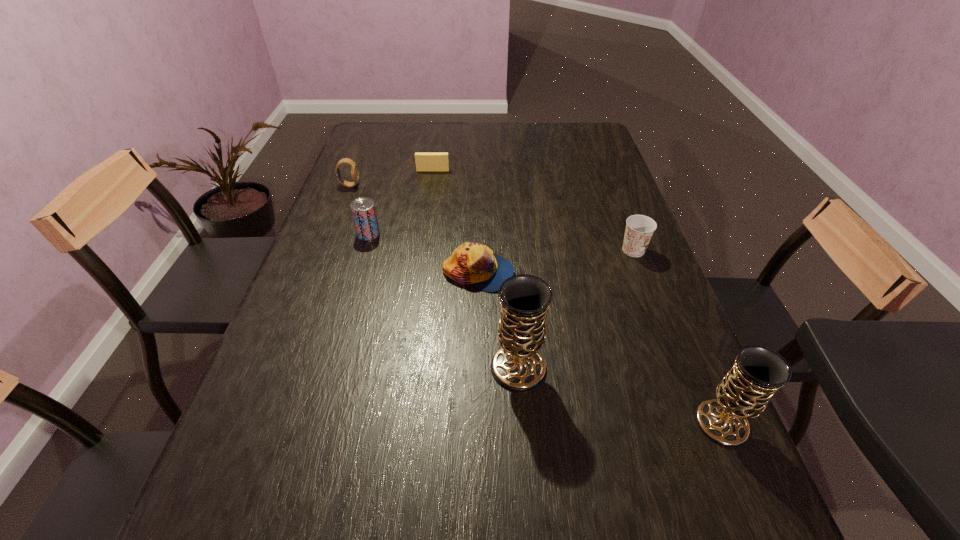
Locate an element on the screen. Image resolution: width=960 pixels, height=540 pixels. the second shortest object is located at coordinates (475, 264).

Identify the location of Dixie cup. The image size is (960, 540). (639, 229).

Find the location of a particular element. vacant region located 0.170m on the left of the taller chalice is located at coordinates (409, 367).

Identify the location of vacant position located 0.270m on the left of the nearer chalice. The image size is (960, 540). (553, 422).

Identify the location of vacant space located 0.050m at the front of the shortest object with spools. (431, 180).

Find the location of a particular element. The image size is (960, 540). free region located 0.300m on the face of the leftmost object is located at coordinates (452, 185).

Where is `blank space located 0.270m on the back of the fifth nearest object`? blank space located 0.270m on the back of the fifth nearest object is located at coordinates (385, 177).

This screenshot has height=540, width=960. I want to click on free space located on the bill of the sixth tallest object, so click(x=577, y=273).

The width and height of the screenshot is (960, 540). Find the location of `free space located 0.390m on the left of the Dixie cup`. free space located 0.390m on the left of the Dixie cup is located at coordinates (474, 251).

In order to click on object located in the near edge section of the desktop in this screenshot , I will do `click(758, 372)`.